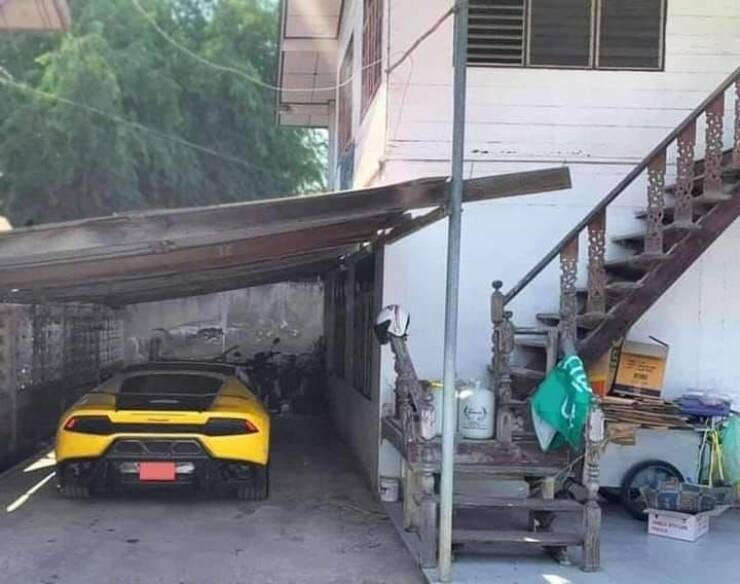
I want to click on decorative post, so click(690, 165), click(716, 146), click(656, 198), click(595, 263), click(568, 283), click(408, 378).